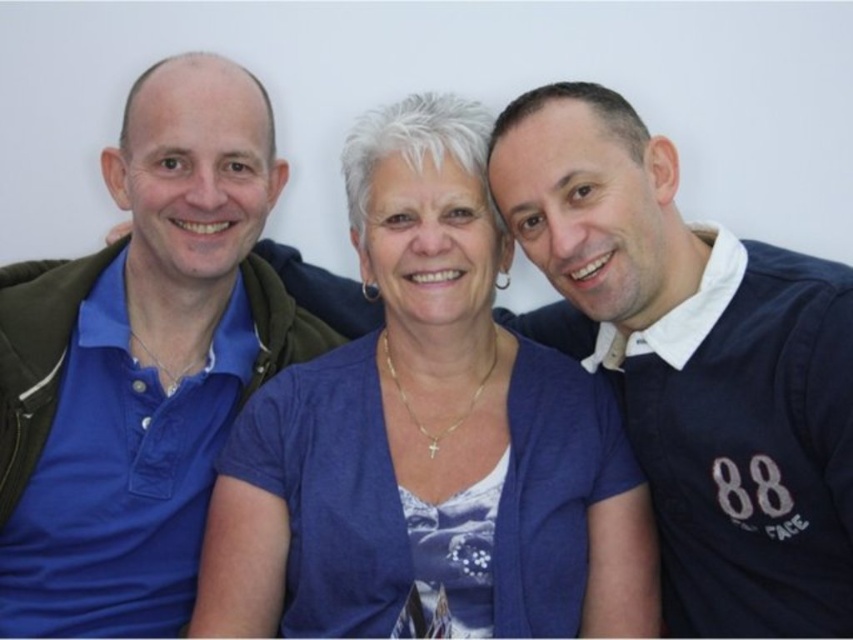
Looking at the scene, which object is positioned to the right of the other between the blue fabric shirt at center and the blue cotton polo shirt at left?

The blue fabric shirt at center is positioned to the right of the blue cotton polo shirt at left.

In the scene shown: You are taking a photo of the three people in the scene. The camera is positioned to capture all three individuals. If you want to ensure the navy blue jersey at right is visible in the frame, where should you focus your attention relative to the other people?

The navy blue jersey at right is located at point (694, 364), so you should focus your attention towards the right side of the frame to ensure it is visible along with the other individuals.

Based on the photo, you are trying to decide which blue shirt to wear for a casual day out. You see the blue fabric shirt at center and the blue cotton polo shirt at left in the image. Which one has a longer length?

The blue cotton polo shirt at left is longer than the blue fabric shirt at center.